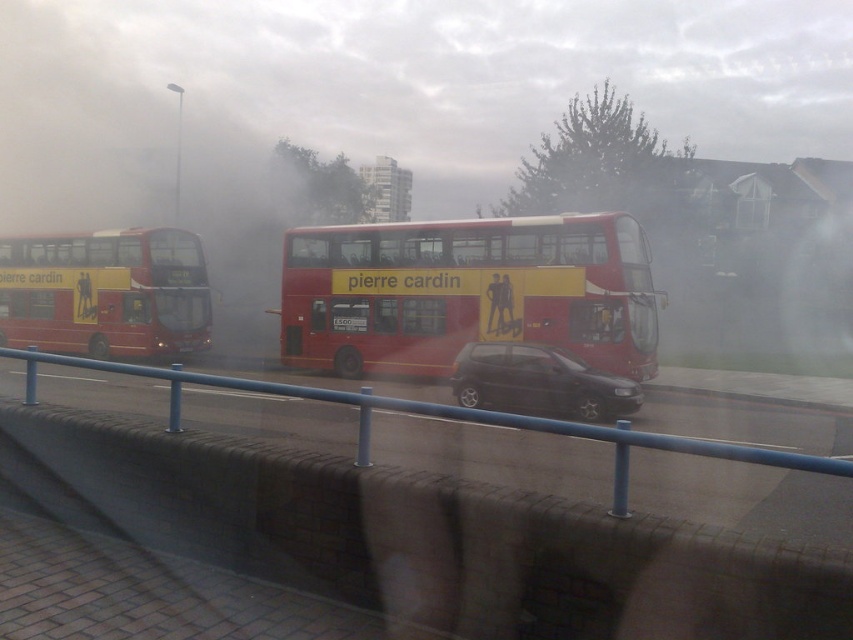
From the picture: Can you confirm if blue metal rail at center is taller than matte red bus at left?

No.

Between blue metal rail at center and matte red bus at left, which one appears on the left side from the viewer's perspective?

matte red bus at left is more to the left.

The image size is (853, 640). Identify the location of blue metal rail at center. (473, 448).

Does red matte double-decker bus at center have a lesser height compared to blue metal rail at center?

In fact, red matte double-decker bus at center may be taller than blue metal rail at center.

How much distance is there between red matte double-decker bus at center and blue metal rail at center?

red matte double-decker bus at center is 4.92 meters from blue metal rail at center.

Does point (405, 288) come closer to viewer compared to point (540, 480)?

No, (405, 288) is further to viewer.

The width and height of the screenshot is (853, 640). Identify the location of red matte double-decker bus at center. (467, 292).

Which is in front, point (386, 268) or point (589, 380)?

Positioned in front is point (589, 380).

Is red matte double-decker bus at center positioned behind shiny black hatchback at center?

Yes.

This screenshot has height=640, width=853. Describe the element at coordinates (467, 292) in the screenshot. I see `red matte double-decker bus at center` at that location.

Identify the location of red matte double-decker bus at center. (x=467, y=292).